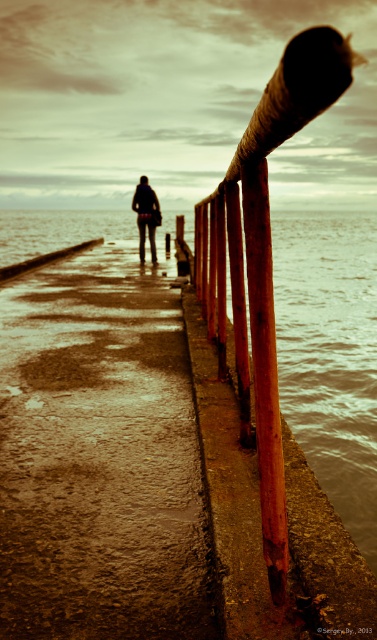
Question: Can you confirm if rusty metal pole at center is wider than dark gray fabric jacket at center?

Choices:
 (A) no
 (B) yes

Answer: (A)

Question: Among these points, which one is farthest from the camera?

Choices:
 (A) (142, 202)
 (B) (355, 266)
 (C) (266, 481)

Answer: (B)

Question: Which point is closer to the camera taking this photo?

Choices:
 (A) (159, 212)
 (B) (260, 440)

Answer: (B)

Question: Among these objects, which one is nearest to the camera?

Choices:
 (A) rusty metal water at right
 (B) rusty metal pole at center
 (C) dark gray fabric jacket at center

Answer: (B)

Question: Is rusty metal pole at center to the right of dark gray fabric jacket at center from the viewer's perspective?

Choices:
 (A) yes
 (B) no

Answer: (A)

Question: Can you confirm if rusty metal water at right is positioned above dark gray fabric jacket at center?

Choices:
 (A) yes
 (B) no

Answer: (A)